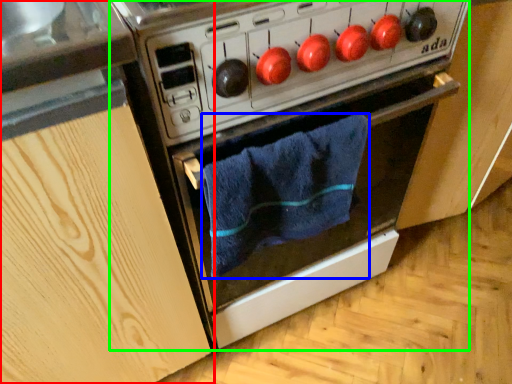
Question: Estimate the real-world distances between objects in this image. Which object is closer to cabinetry (highlighted by a red box), bath towel (highlighted by a blue box) or oven (highlighted by a green box)?

Choices:
 (A) bath towel
 (B) oven

Answer: (B)